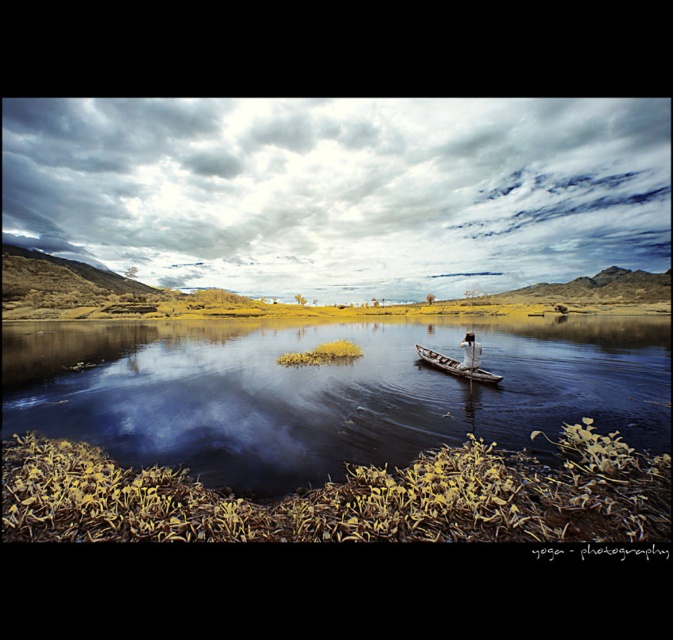
Question: Which of these objects is positioned closest to the smooth dark water at center?

Choices:
 (A) white fabric boat at center
 (B) wooden canoe at center

Answer: (B)

Question: Which object is closer to the camera taking this photo?

Choices:
 (A) white fabric boat at center
 (B) wooden canoe at center

Answer: (B)

Question: Is smooth dark water at center behind white fabric boat at center?

Choices:
 (A) no
 (B) yes

Answer: (A)

Question: Estimate the real-world distances between objects in this image. Which object is closer to the wooden canoe at center?

Choices:
 (A) white fabric boat at center
 (B) smooth dark water at center

Answer: (A)

Question: Does smooth dark water at center have a lesser width compared to white fabric boat at center?

Choices:
 (A) no
 (B) yes

Answer: (A)

Question: Does smooth dark water at center appear over wooden canoe at center?

Choices:
 (A) yes
 (B) no

Answer: (A)